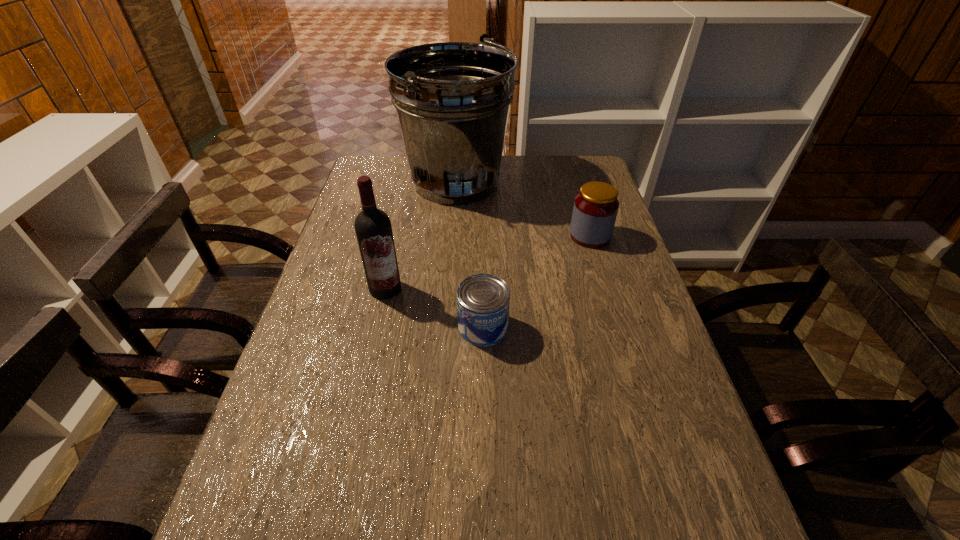
This screenshot has height=540, width=960. I want to click on free point between the can and the second tallest object, so click(x=434, y=308).

Locate an element on the screen. the second closest object to the wine bottle is located at coordinates (452, 99).

Identify which object is the closest to the jar. Please provide its 2D coordinates. Your answer should be formatted as a tuple, i.e. [(x, y)], where the tuple contains the x and y coordinates of a point satisfying the conditions above.

[(452, 99)]

You are a GUI agent. You are given a task and a screenshot of the screen. Output one action in this format:
    pyautogui.click(x=<x>, y=<y>)
    Task: Click on the free region that satisfies the following two spatial constraints: 1. on the front side of the third tallest object; 2. on the left side of the tallest object
    The height and width of the screenshot is (540, 960).
    Given the screenshot: What is the action you would take?
    pyautogui.click(x=453, y=236)